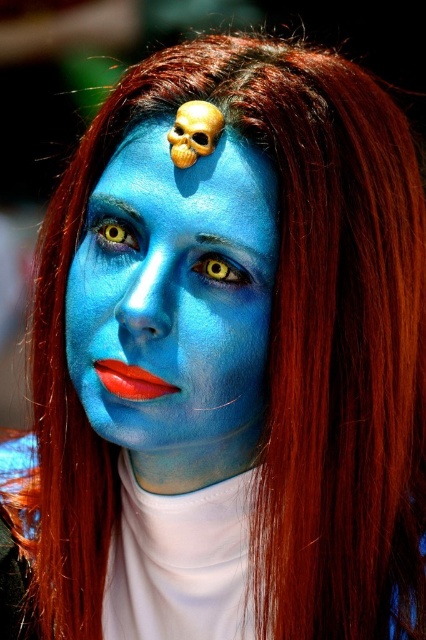
Question: Does blue matte face paint at center lie in front of yellow matte eye at center?

Choices:
 (A) yes
 (B) no

Answer: (B)

Question: Can you confirm if blue matte face paint at center is wider than yellow matte eye at upper left?

Choices:
 (A) no
 (B) yes

Answer: (B)

Question: Can you confirm if blue matte face at center is positioned to the left of yellow matte eye at upper left?

Choices:
 (A) yes
 (B) no

Answer: (B)

Question: Which point appears closest to the camera in this image?

Choices:
 (A) (104, 228)
 (B) (230, 147)
 (C) (192, 268)
 (D) (120, 524)

Answer: (B)

Question: Estimate the real-world distances between objects in this image. Which object is farther from the yellow matte eye at upper left?

Choices:
 (A) yellow matte eye at center
 (B) blue matte face at center
 (C) blue matte face paint at center

Answer: (C)

Question: Estimate the real-world distances between objects in this image. Which object is closer to the yellow matte eye at center?

Choices:
 (A) blue matte face paint at center
 (B) blue matte face at center
 (C) yellow matte eye at upper left

Answer: (C)